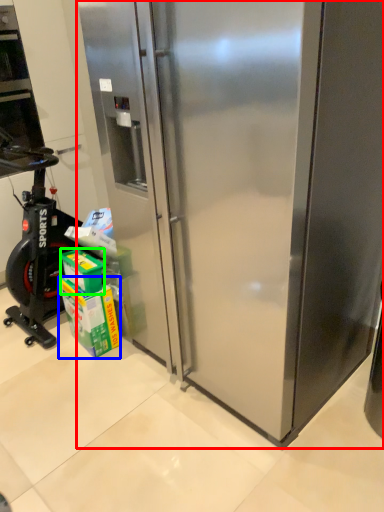
Question: Based on their relative distances, which object is nearer to refrigerator (highlighted by a red box)? Choose from carton (highlighted by a blue box) and box (highlighted by a green box).

Choices:
 (A) carton
 (B) box

Answer: (A)